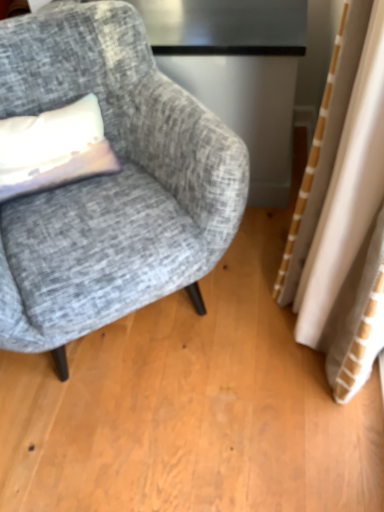
Locate an element on the screen. Image resolution: width=384 pixels, height=512 pixels. matte white pillow at left is located at coordinates (53, 148).

Describe the element at coordinates (53, 148) in the screenshot. I see `matte white pillow at left` at that location.

Measure the distance between textured gray fabric chair at left and camera.

The depth of textured gray fabric chair at left is 39.30 inches.

What are the coordinates of `textured gray fabric chair at left` in the screenshot? It's located at (110, 181).

What do you see at coordinates (110, 181) in the screenshot?
I see `textured gray fabric chair at left` at bounding box center [110, 181].

This screenshot has height=512, width=384. Identify the location of matte white pillow at left. (53, 148).

Considering the positions of objects textured gray fabric chair at left and matte white pillow at left in the image provided, who is more to the left, textured gray fabric chair at left or matte white pillow at left?

From the viewer's perspective, matte white pillow at left appears more on the left side.

Is the position of textured gray fabric chair at left more distant than that of matte white pillow at left?

No, it is not.

Which point is more forward, (151,259) or (30,160)?

Positioned in front is point (151,259).

From the image's perspective, between textured gray fabric chair at left and matte white pillow at left, who is located below?

textured gray fabric chair at left, from the image's perspective.

From a real-world perspective, which is physically above, textured gray fabric chair at left or matte white pillow at left?

matte white pillow at left is physically above.

Does textured gray fabric chair at left have a lesser width compared to matte white pillow at left?

No, textured gray fabric chair at left is not thinner than matte white pillow at left.

From their relative heights in the image, would you say textured gray fabric chair at left is taller or shorter than matte white pillow at left?

Clearly, textured gray fabric chair at left is taller compared to matte white pillow at left.

Considering the sizes of objects textured gray fabric chair at left and matte white pillow at left in the image provided, who is smaller, textured gray fabric chair at left or matte white pillow at left?

Smaller between the two is matte white pillow at left.

Is textured gray fabric chair at left inside or outside of matte white pillow at left?

textured gray fabric chair at left is located beyond the bounds of matte white pillow at left.

Is textured gray fabric chair at left with matte white pillow at left?

textured gray fabric chair at left is not next to matte white pillow at left, and they're not touching.

Is textured gray fabric chair at left aimed at matte white pillow at left?

Yes, textured gray fabric chair at left faces towards matte white pillow at left.

Based on the photo, can you tell me how much textured gray fabric chair at left and matte white pillow at left differ in facing direction?

The angular difference between textured gray fabric chair at left and matte white pillow at left is 5.81 degrees.

How much distance is there between textured gray fabric chair at left and matte white pillow at left?

6.89 inches.

You are a GUI agent. You are given a task and a screenshot of the screen. Output one action in this format:
    pyautogui.click(x=<x>, y=<y>)
    Task: Click on the chair on the right of matte white pillow at left
    The image size is (384, 512).
    Given the screenshot: What is the action you would take?
    pyautogui.click(x=110, y=181)

Would you say matte white pillow at left is to the left or to the right of textured gray fabric chair at left in the picture?

From the image, it's evident that matte white pillow at left is to the left of textured gray fabric chair at left.

Which object is further away from the camera taking this photo, matte white pillow at left or textured gray fabric chair at left?

matte white pillow at left is further from the camera.

Which is in front, point (64, 166) or point (132, 56)?

The point (64, 166) is in front.

From the image's perspective, which is below, matte white pillow at left or textured gray fabric chair at left?

From the image's view, textured gray fabric chair at left is below.

From a real-world perspective, does matte white pillow at left sit lower than textured gray fabric chair at left?

No, from a real-world perspective, matte white pillow at left is not beneath textured gray fabric chair at left.

Which object is wider, matte white pillow at left or textured gray fabric chair at left?

textured gray fabric chair at left is wider.

Considering the sizes of matte white pillow at left and textured gray fabric chair at left in the image, is matte white pillow at left taller or shorter than textured gray fabric chair at left?

Clearly, matte white pillow at left is shorter compared to textured gray fabric chair at left.

Based on the photo, which of these two, matte white pillow at left or textured gray fabric chair at left, is smaller?

matte white pillow at left.

Choose the correct answer: Is matte white pillow at left inside textured gray fabric chair at left or outside it?

matte white pillow at left lies within the bounds of textured gray fabric chair at left.

Is matte white pillow at left next to textured gray fabric chair at left?

No, matte white pillow at left is not beside textured gray fabric chair at left.

Is matte white pillow at left facing away from textured gray fabric chair at left?

Yes, matte white pillow at left is facing away from textured gray fabric chair at left.

Consider the image. What's the angular difference between matte white pillow at left and textured gray fabric chair at left's facing directions?

The angle between the facing direction of matte white pillow at left and the facing direction of textured gray fabric chair at left is 5.81 degrees.

How far apart are matte white pillow at left and textured gray fabric chair at left?

matte white pillow at left and textured gray fabric chair at left are 6.89 inches apart.

Locate an element on the screen. The width and height of the screenshot is (384, 512). chair that appears below the matte white pillow at left (from a real-world perspective) is located at coordinates (110, 181).

Identify the location of chair that appears below the matte white pillow at left (from a real-world perspective). (110, 181).

You are a GUI agent. You are given a task and a screenshot of the screen. Output one action in this format:
    pyautogui.click(x=<x>, y=<y>)
    Task: Click on the pillow that is above the textured gray fabric chair at left (from the image's perspective)
    This screenshot has height=512, width=384.
    Given the screenshot: What is the action you would take?
    pyautogui.click(x=53, y=148)